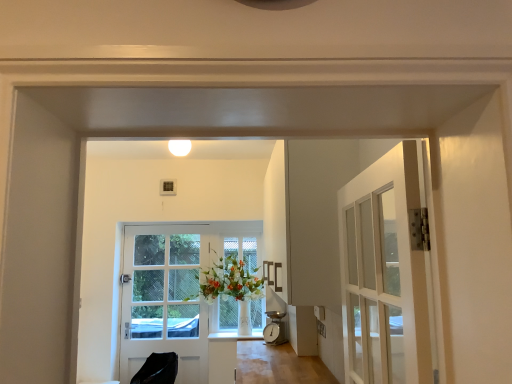
Question: Is the depth of white matte light fixture at upper center greater than that of white glossy door at center?

Choices:
 (A) no
 (B) yes

Answer: (A)

Question: Would you say white matte light fixture at upper center contains white glossy door at center?

Choices:
 (A) yes
 (B) no

Answer: (B)

Question: Is white matte light fixture at upper center to the left of white glossy door at center from the viewer's perspective?

Choices:
 (A) no
 (B) yes

Answer: (A)

Question: Can we say white matte light fixture at upper center lies outside white glossy door at center?

Choices:
 (A) no
 (B) yes

Answer: (B)

Question: Does white matte light fixture at upper center have a lesser height compared to white glossy door at center?

Choices:
 (A) no
 (B) yes

Answer: (B)

Question: Can you confirm if white matte light fixture at upper center is wider than white glossy door at center?

Choices:
 (A) yes
 (B) no

Answer: (A)

Question: Is black leather chair at lower left smaller than white matte light fixture at upper center?

Choices:
 (A) no
 (B) yes

Answer: (A)

Question: Is black leather chair at lower left completely or partially outside of white matte light fixture at upper center?

Choices:
 (A) yes
 (B) no

Answer: (A)

Question: Is white matte light fixture at upper center inside black leather chair at lower left?

Choices:
 (A) yes
 (B) no

Answer: (B)

Question: From a real-world perspective, is black leather chair at lower left under white matte light fixture at upper center?

Choices:
 (A) no
 (B) yes

Answer: (B)

Question: Can you confirm if black leather chair at lower left is positioned to the left of white matte light fixture at upper center?

Choices:
 (A) no
 (B) yes

Answer: (B)

Question: Considering the relative sizes of black leather chair at lower left and white matte light fixture at upper center in the image provided, is black leather chair at lower left thinner than white matte light fixture at upper center?

Choices:
 (A) no
 (B) yes

Answer: (A)

Question: Is white matte light fixture at upper center a part of clear glass window at center?

Choices:
 (A) no
 (B) yes

Answer: (A)